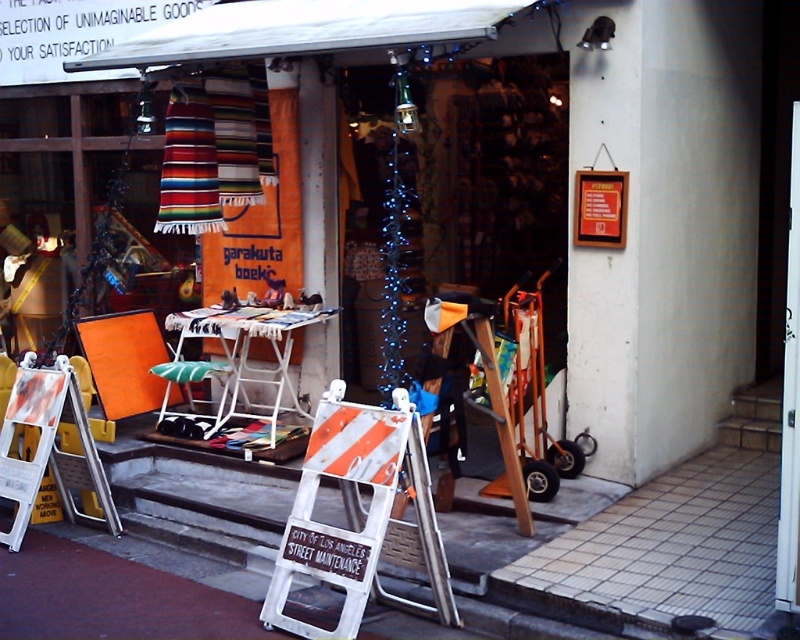
You are a customer standing in front of the shop and want to read the text on both the matte black sign at center and the white plastic ladder at center. Which object will you need to look up to see the text?

The white plastic ladder at center requires you to look up because it is smaller than the matte black sign at center, so it might be placed higher up to be visible.

You are a customer standing in front of the shop and want to place a small decorative item on the table between the matte black sign at center and the white plastic ladder at center. Which object should you place it closer to so that it fits better?

The matte black sign at center is wider than the white plastic ladder at center, so placing the small decorative item closer to the white plastic ladder at center would allow it to fit better between them.

You are standing in front of the shop and want to locate the matte black sign at center. Can you tell me its coordinates?

The matte black sign at center is located at coordinates point (468, 184).